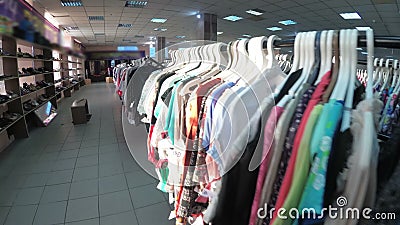
Identify the location of floor tile. (117, 199), (92, 184), (93, 137), (48, 160).